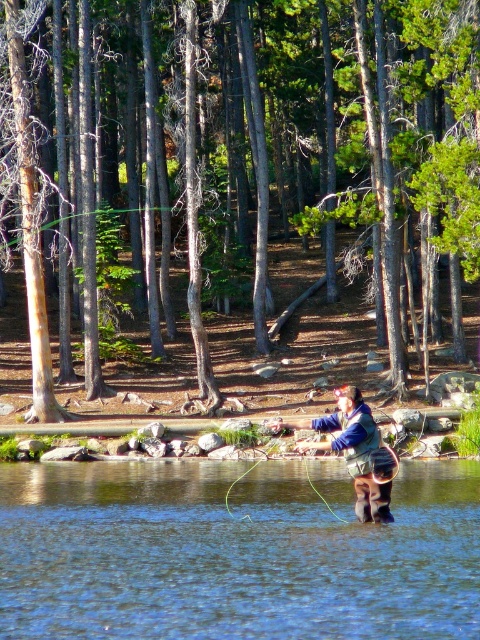
Question: Is blue water at center positioned behind blue fleece jacket at center?

Choices:
 (A) yes
 (B) no

Answer: (B)

Question: Does blue water at center have a lesser width compared to blue fleece jacket at center?

Choices:
 (A) yes
 (B) no

Answer: (B)

Question: Which of the following is the closest to the observer?

Choices:
 (A) (122, 612)
 (B) (384, 468)

Answer: (A)

Question: Observing the image, what is the correct spatial positioning of blue water at center in reference to blue fleece jacket at center?

Choices:
 (A) above
 (B) below

Answer: (B)

Question: Which of the following is the closest to the observer?

Choices:
 (A) (334, 451)
 (B) (343, 621)

Answer: (B)